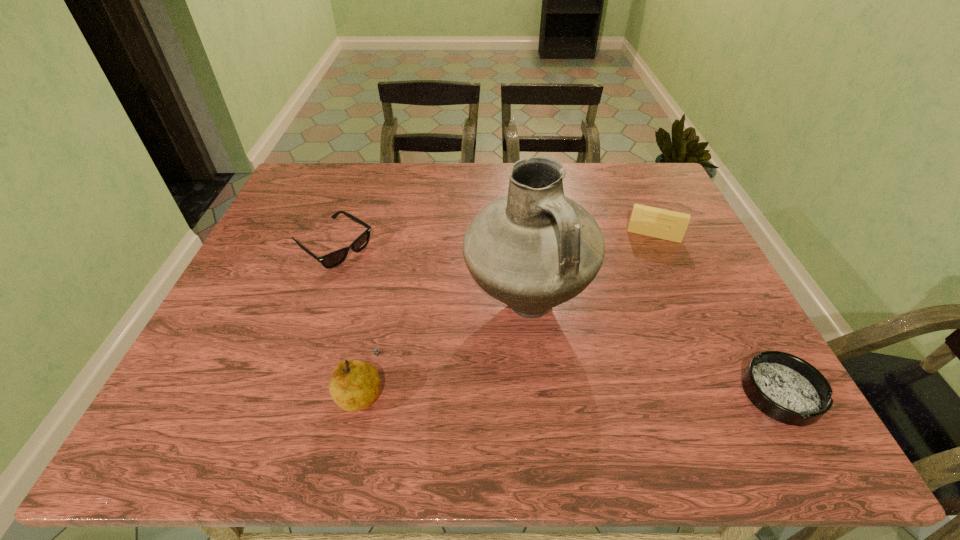
Find the location of `vacant spot on the desktop that is between the pear and the shortest object and is positioned on the front-facing side of the sunglasses`. vacant spot on the desktop that is between the pear and the shortest object and is positioned on the front-facing side of the sunglasses is located at coordinates (550, 392).

The height and width of the screenshot is (540, 960). What are the coordinates of `free spot on the desktop that is between the pear and the ashtray and is positioned at the front of the videotape with spools` in the screenshot? It's located at (629, 392).

I want to click on free spot on the desktop that is between the fourth object from right to left and the ashtray and is positioned on the handle side of the tallest object, so click(632, 392).